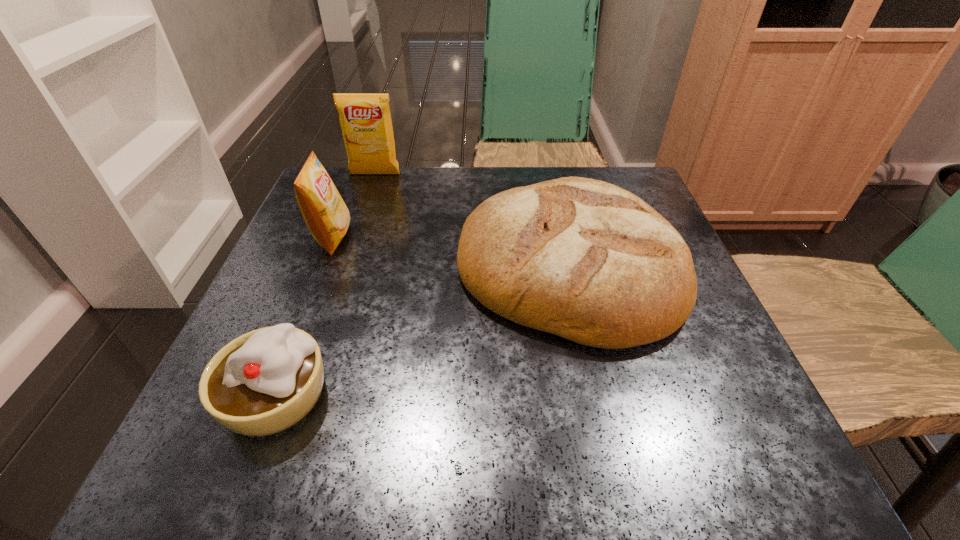
Find the location of `empty space between the whipped cream and the nearer crisp (potato chip)`. empty space between the whipped cream and the nearer crisp (potato chip) is located at coordinates (304, 316).

Identify the location of object that stands as the closest to the farthest object. This screenshot has width=960, height=540. (326, 215).

Identify which object is the second closest to the shorter crisp (potato chip). Please provide its 2D coordinates. Your answer should be formatted as a tuple, i.e. [(x, y)], where the tuple contains the x and y coordinates of a point satisfying the conditions above.

[(586, 260)]

Locate an element on the screen. The height and width of the screenshot is (540, 960). vacant space that satisfies the following two spatial constraints: 1. on the front-facing side of the third shortest object; 2. on the left side of the whipped cream is located at coordinates (271, 395).

Locate an element on the screen. This screenshot has width=960, height=540. vacant position in the image that satisfies the following two spatial constraints: 1. on the front-facing side of the nearer crisp (potato chip); 2. on the back side of the whipped cream is located at coordinates (271, 395).

At what (x,y) coordinates should I click in order to perform the action: click on vacant position in the image that satisfies the following two spatial constraints: 1. on the front of the bread with the logo; 2. on the left side of the taller crisp (potato chip). Please return your answer as a coordinate pair (x, y). This screenshot has height=540, width=960. Looking at the image, I should click on 344,266.

You are a GUI agent. You are given a task and a screenshot of the screen. Output one action in this format:
    pyautogui.click(x=<x>, y=<y>)
    Task: Click on the free space that satisfies the following two spatial constraints: 1. on the front-facing side of the nearer crisp (potato chip); 2. on the right side of the bread
    The image size is (960, 540).
    Given the screenshot: What is the action you would take?
    pyautogui.click(x=322, y=266)

Locate an element on the screen. The width and height of the screenshot is (960, 540). vacant point that satisfies the following two spatial constraints: 1. on the front of the bread with the logo; 2. on the left side of the farthest object is located at coordinates (344, 266).

Identify the location of free location that satisfies the following two spatial constraints: 1. on the back side of the rightmost object; 2. on the front-facing side of the nearer crisp (potato chip). (563, 238).

Locate an element on the screen. vacant point that satisfies the following two spatial constraints: 1. on the front-facing side of the whipped cream; 2. on the right side of the shorter crisp (potato chip) is located at coordinates (271, 395).